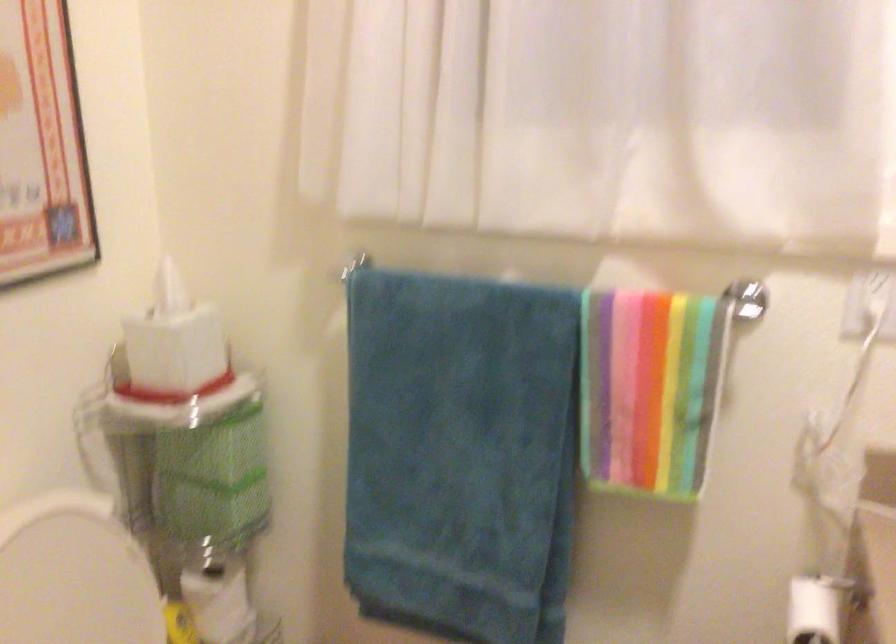
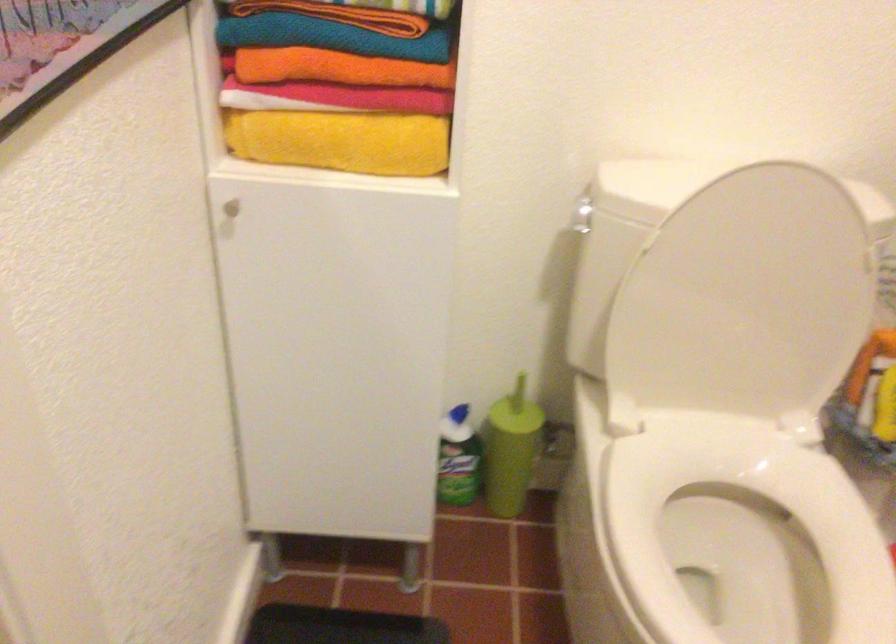
First-person continuous shooting, in which direction is the camera rotating?

The camera's rotation is toward left-down.